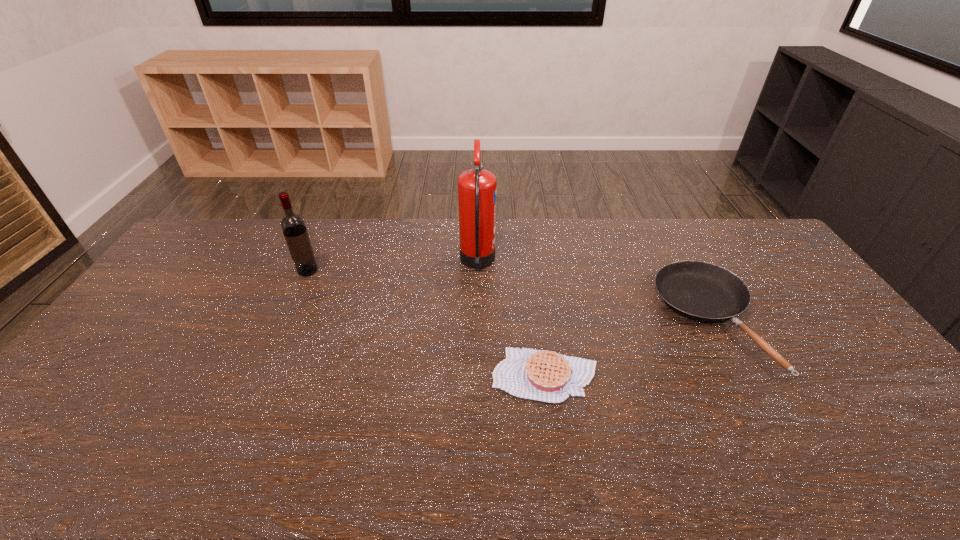
You are a GUI agent. You are given a task and a screenshot of the screen. Output one action in this format:
    pyautogui.click(x=<x>, y=<y>)
    Task: Click on the tallest object
    
    Given the screenshot: What is the action you would take?
    pyautogui.click(x=477, y=187)

Find the location of `the third shortest object`. the third shortest object is located at coordinates (293, 226).

Identify the location of wine bottle. (293, 226).

Locate an element on the screen. This screenshot has width=960, height=540. the rightmost object is located at coordinates (705, 292).

Where is `pie`? This screenshot has height=540, width=960. pie is located at coordinates (542, 375).

Where is `vacant space situated 0.280m on the surface of the tallest object`? vacant space situated 0.280m on the surface of the tallest object is located at coordinates point(575,263).

At what (x,y) coordinates should I click in order to perform the action: click on vacant space located 0.330m on the right of the second tallest object. Please return your answer as a coordinate pair (x, y). Looking at the image, I should click on (414, 271).

Where is `free space located on the back of the rightmost object`? free space located on the back of the rightmost object is located at coordinates (659, 224).

Find the location of a particular element. vacant region located 0.090m on the front of the pie is located at coordinates (554, 438).

This screenshot has width=960, height=540. In order to click on object that is at the far edge in this screenshot , I will do `click(477, 187)`.